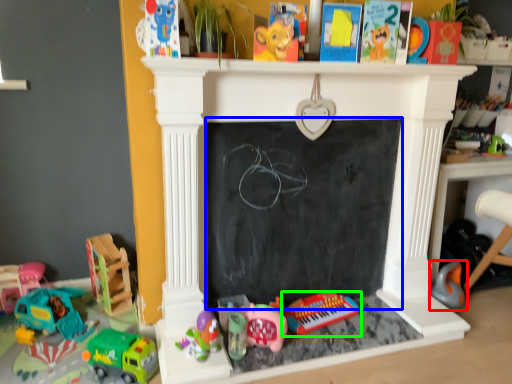
Question: Estimate the real-world distances between objects in this image. Which object is farther from toy (highlighted by a red box), bulletin board (highlighted by a blue box) or toy (highlighted by a green box)?

Choices:
 (A) bulletin board
 (B) toy

Answer: (A)